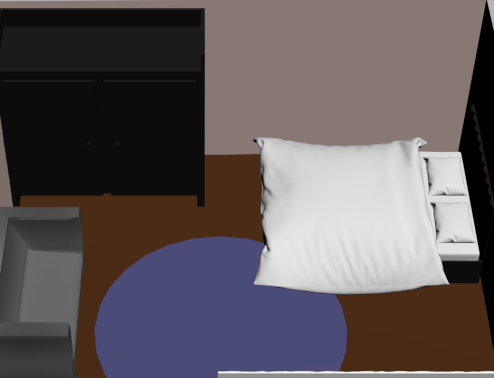
Find the location of `round rug`. round rug is located at coordinates (300, 321).